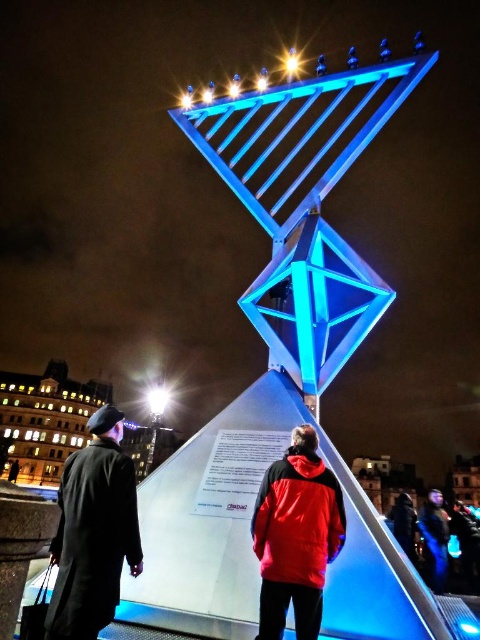
Question: Is red matte jacket at center closer to camera compared to bright white bulb at center?

Choices:
 (A) no
 (B) yes

Answer: (B)

Question: Does dark wool coat at left have a smaller size compared to blue glass light at upper center?

Choices:
 (A) yes
 (B) no

Answer: (A)

Question: Which point is farther to the camera?

Choices:
 (A) blue glass light at upper center
 (B) red matte jacket at center
 (C) dark wool coat at left

Answer: (A)

Question: Which point is closer to the camera?

Choices:
 (A) red matte jacket at center
 (B) bright white bulb at center

Answer: (A)

Question: Is dark wool coat at left closer to the viewer compared to bright white bulb at center?

Choices:
 (A) no
 (B) yes

Answer: (B)

Question: Which point is closer to the camera taking this photo?

Choices:
 (A) (160, 392)
 (B) (314, 484)

Answer: (B)